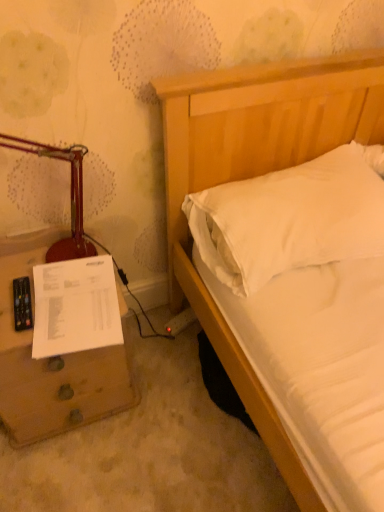
At what (x,y) coordinates should I click in order to perform the action: click on free point below white paper at lower left (from a real-world perspective). Please return your answer as a coordinate pair (x, y). The height and width of the screenshot is (512, 384). Looking at the image, I should click on (84, 324).